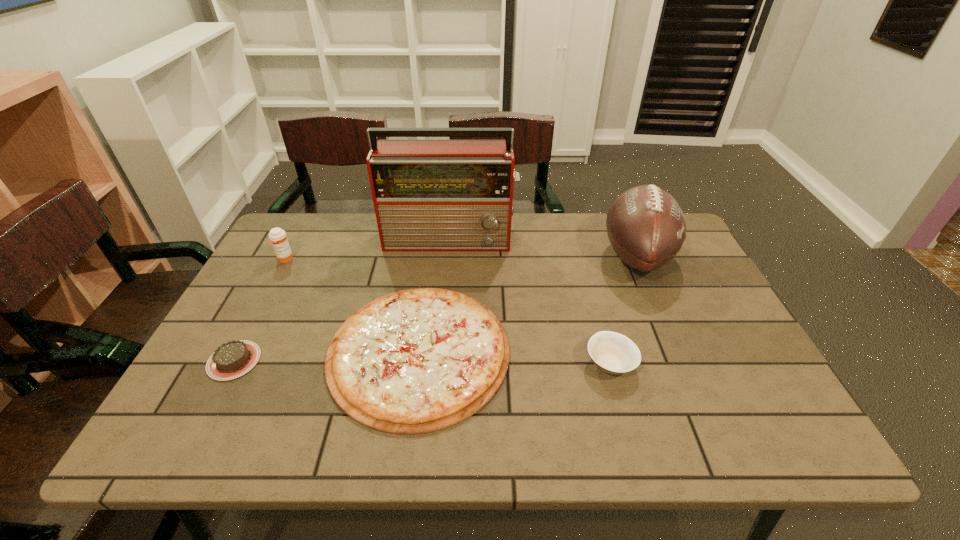
This screenshot has width=960, height=540. I want to click on the tallest object, so click(x=429, y=195).

This screenshot has width=960, height=540. I want to click on football (American), so click(646, 227).

This screenshot has height=540, width=960. In order to click on medicine in this screenshot , I will do (277, 236).

Where is `bowl`? The width and height of the screenshot is (960, 540). bowl is located at coordinates (613, 353).

Identify the location of the second shortest object. (233, 359).

At what (x,y) coordinates should I click in order to perform the action: click on the shortest object. Please return your answer as a coordinate pair (x, y). Looking at the image, I should click on (415, 361).

Where is `vacant space located on the front-facing side of the radio receiver`? Image resolution: width=960 pixels, height=540 pixels. vacant space located on the front-facing side of the radio receiver is located at coordinates (446, 292).

Identify the location of free spot located 0.170m on the front of the football (American). This screenshot has height=540, width=960. (674, 342).

Identify the location of free space located 0.130m on the front of the medicine. (266, 295).

Find the location of `blank space located 0.100m on the right of the third shortest object`. blank space located 0.100m on the right of the third shortest object is located at coordinates (679, 364).